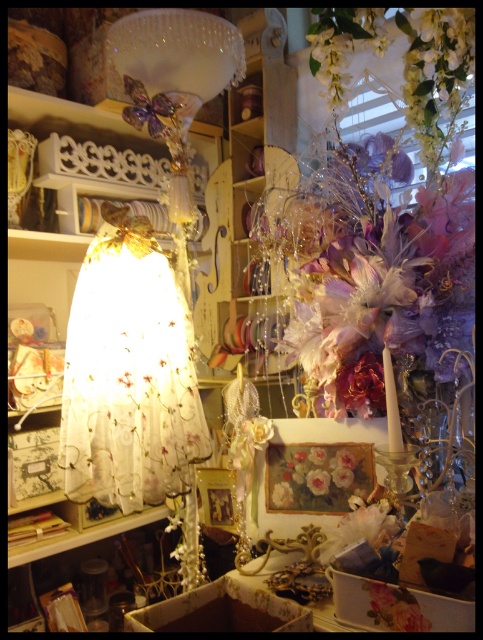
Question: Can you confirm if white lace lampshade at upper center is smaller than pastel floral painting at center?

Choices:
 (A) yes
 (B) no

Answer: (B)

Question: Which point is farther to the camera?

Choices:
 (A) translucent fabric lampshade at left
 (B) matte white flower at center
 (C) pastel floral painting at center

Answer: (A)

Question: Considering the relative positions of translucent fabric lampshade at left and white lace lampshade at upper center in the image provided, where is translucent fabric lampshade at left located with respect to white lace lampshade at upper center?

Choices:
 (A) left
 (B) right

Answer: (A)

Question: Which of these objects is positioned closest to the white lace lampshade at upper center?

Choices:
 (A) pastel floral painting at center
 (B) translucent fabric lampshade at left
 (C) matte white flower at center

Answer: (B)

Question: Among these objects, which one is nearest to the camera?

Choices:
 (A) translucent fabric lampshade at left
 (B) white lace lampshade at upper center
 (C) matte white flower at center
 (D) pastel floral painting at center

Answer: (D)

Question: Considering the relative positions of translucent fabric lampshade at left and pastel floral painting at center in the image provided, where is translucent fabric lampshade at left located with respect to pastel floral painting at center?

Choices:
 (A) below
 (B) above

Answer: (B)